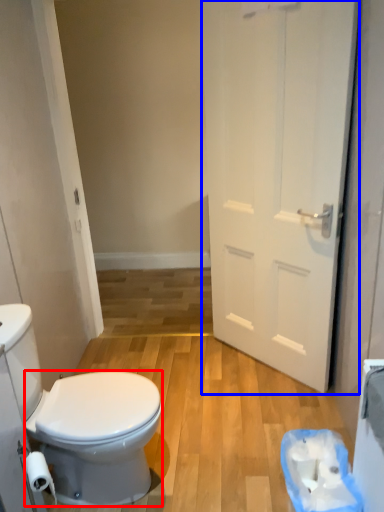
Question: Among these objects, which one is farthest to the camera, bidet (highlighted by a red box) or door (highlighted by a blue box)?

Choices:
 (A) bidet
 (B) door

Answer: (B)